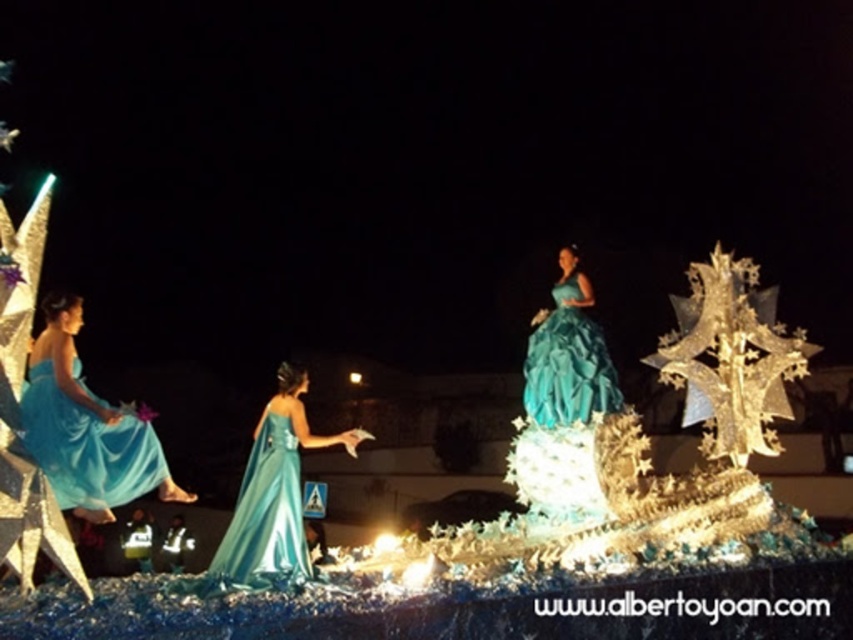
Question: Is matte blue dress at left positioned in front of teal satin gown at center?

Choices:
 (A) yes
 (B) no

Answer: (A)

Question: Among these objects, which one is nearest to the camera?

Choices:
 (A) satin teal gown at center
 (B) matte blue dress at left

Answer: (B)

Question: Which of these objects is positioned closest to the matte blue dress at left?

Choices:
 (A) teal satin gown at center
 (B) satin teal gown at center

Answer: (B)

Question: Does matte blue dress at left have a greater width compared to teal satin gown at center?

Choices:
 (A) no
 (B) yes

Answer: (B)

Question: Which point appears farthest from the camera in this image?

Choices:
 (A) (280, 458)
 (B) (65, 406)

Answer: (A)

Question: Is matte blue dress at left smaller than teal satin gown at center?

Choices:
 (A) yes
 (B) no

Answer: (B)